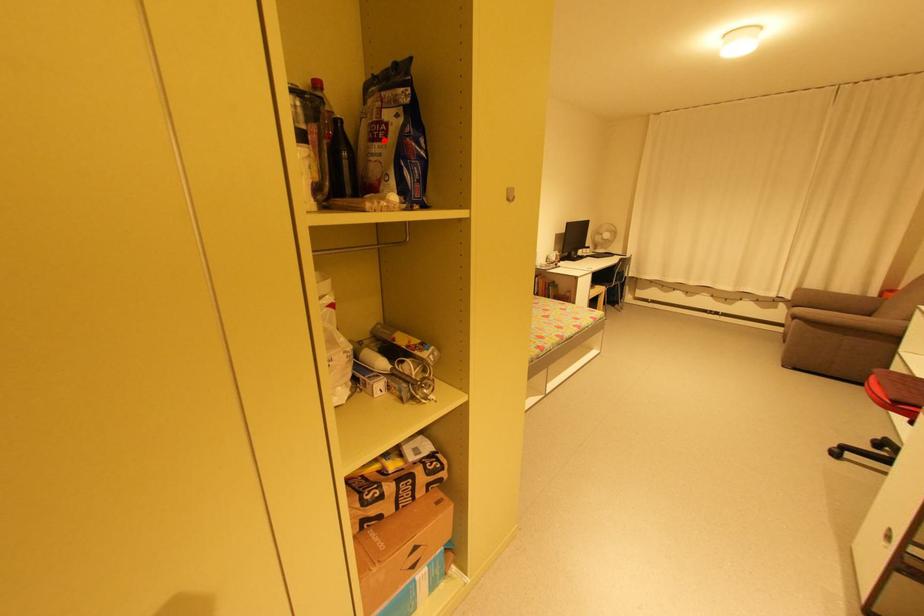
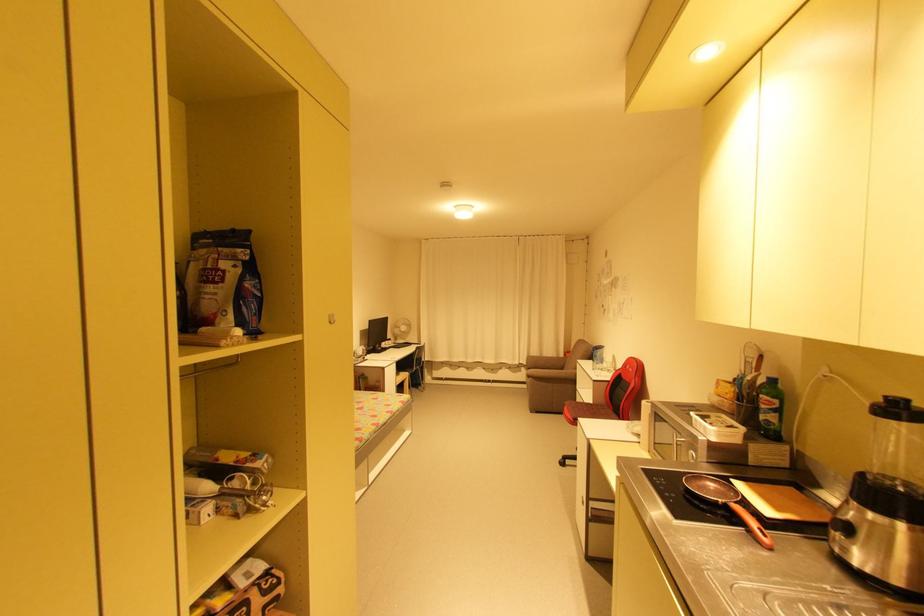
Locate, in the second image, the point that corresponds to the highlighted location in the first image.

(220, 283)